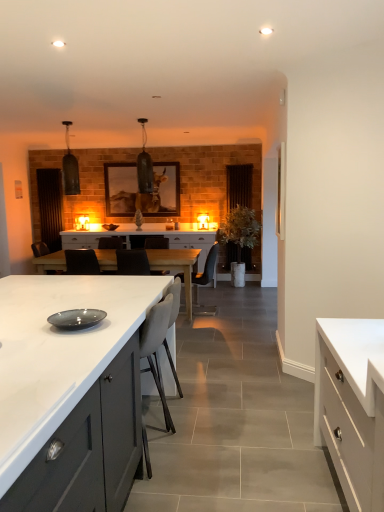
Question: Is transparent glass door at center, which appears as the first glass door when viewed from the right, a part of white matte cabinet at right, the 2th cabinetry positioned from the back?

Choices:
 (A) yes
 (B) no

Answer: (B)

Question: Is white matte cabinet at right, the 2th cabinetry positioned from the back, positioned behind transparent glass door at center, which is the 2th glass door in left-to-right order?

Choices:
 (A) yes
 (B) no

Answer: (B)

Question: Is white matte cabinet at right, the 2th cabinetry positioned from the back, looking in the opposite direction of transparent glass door at center, which appears as the first glass door when viewed from the right?

Choices:
 (A) no
 (B) yes

Answer: (A)

Question: From the image's perspective, is white matte cabinet at right, which is the 3th cabinetry from left to right, beneath transparent glass door at center, which appears as the first glass door when viewed from the right?

Choices:
 (A) yes
 (B) no

Answer: (A)

Question: Considering the relative sizes of white matte cabinet at right, which is the 3th cabinetry from left to right, and transparent glass door at center, which is the 2th glass door in left-to-right order, in the image provided, is white matte cabinet at right, which is the 3th cabinetry from left to right, wider than transparent glass door at center, which is the 2th glass door in left-to-right order,?

Choices:
 (A) no
 (B) yes

Answer: (B)

Question: Is white matte cabinet at right, the 2th cabinetry positioned from the back, in front of or behind white glossy table at center in the image?

Choices:
 (A) front
 (B) behind

Answer: (A)

Question: Is white matte cabinet at right, the 2th cabinetry from the front, wider or thinner than white glossy table at center?

Choices:
 (A) wide
 (B) thin

Answer: (B)

Question: From the image's perspective, is white matte cabinet at right, the 2th cabinetry from the front, positioned above or below white glossy table at center?

Choices:
 (A) above
 (B) below

Answer: (B)

Question: Considering the positions of point (334, 403) and point (102, 263), is point (334, 403) closer or farther from the camera than point (102, 263)?

Choices:
 (A) closer
 (B) farther

Answer: (A)

Question: From their relative heights in the image, would you say white matte cabinet at right, which is the 3th cabinetry from left to right, is taller or shorter than matte gray plate at center?

Choices:
 (A) short
 (B) tall

Answer: (B)

Question: Based on their sizes in the image, would you say white matte cabinet at right, which is the 3th cabinetry from left to right, is bigger or smaller than matte gray plate at center?

Choices:
 (A) small
 (B) big

Answer: (B)

Question: Is white matte cabinet at right, the 2th cabinetry from the front, wider or thinner than matte gray plate at center?

Choices:
 (A) wide
 (B) thin

Answer: (A)

Question: Which is correct: white matte cabinet at right, the 2th cabinetry from the front, is inside matte gray plate at center, or outside of it?

Choices:
 (A) outside
 (B) inside

Answer: (A)

Question: Is point (79, 453) positioned closer to the camera than point (236, 174)?

Choices:
 (A) farther
 (B) closer

Answer: (B)

Question: Looking at their shapes, would you say white matte cabinet at center, the 1th cabinetry when ordered from front to back, is wider or thinner than transparent glass door at center, which is the 2th glass door in left-to-right order?

Choices:
 (A) wide
 (B) thin

Answer: (A)